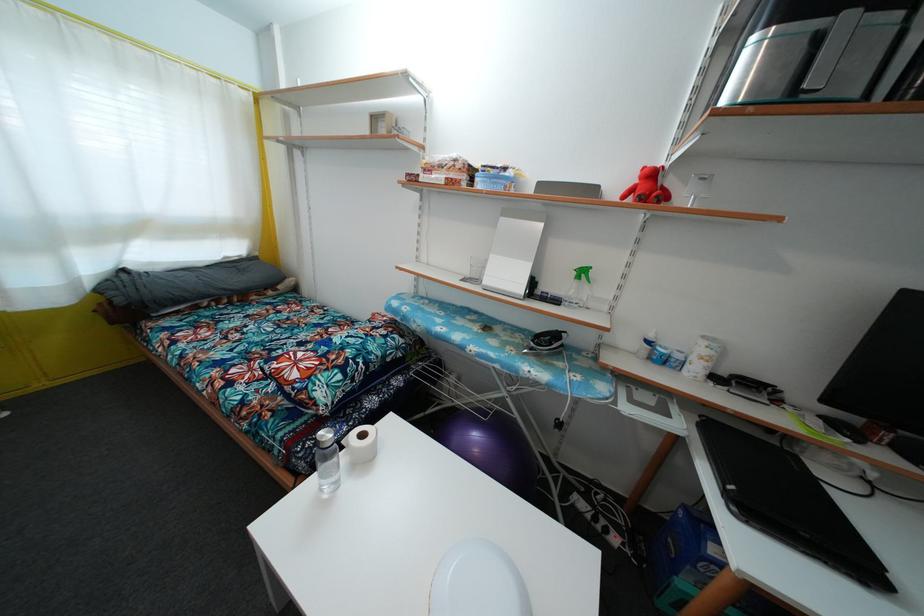
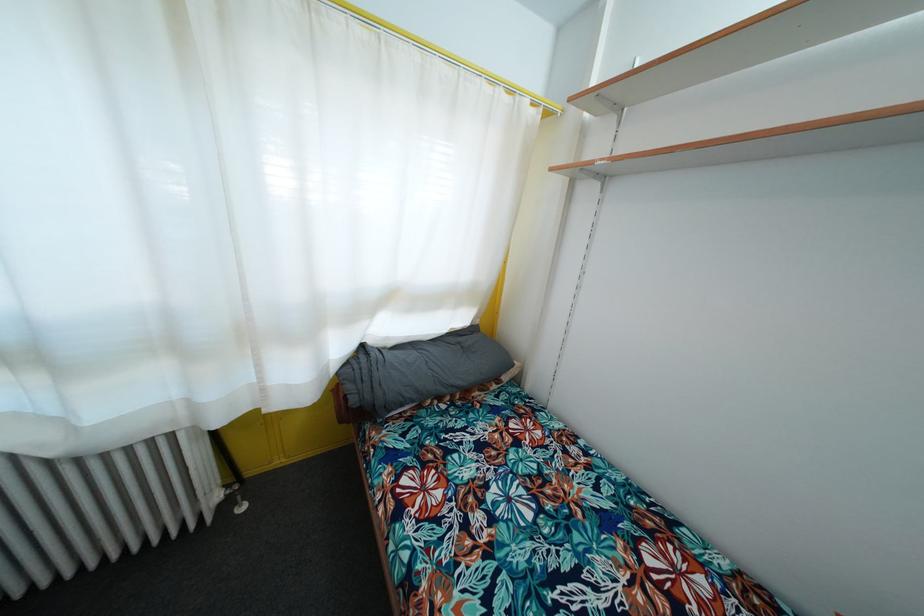
Where in the second image is the point corresponding to pixel 123 307 from the first image?

(358, 407)